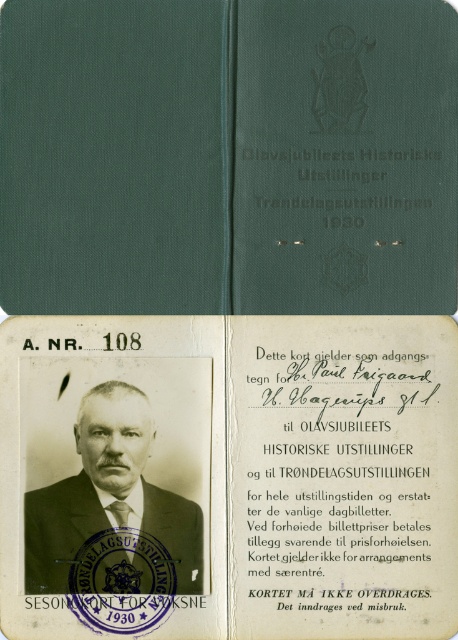
Question: Which is nearer to the white paper card at center?

Choices:
 (A) matte black suit at center
 (B) green fabric journal at center

Answer: (A)

Question: Which object appears farthest from the camera in this image?

Choices:
 (A) white paper card at center
 (B) green fabric journal at center
 (C) matte black suit at center

Answer: (B)

Question: Does white paper card at center appear on the right side of matte black suit at center?

Choices:
 (A) no
 (B) yes

Answer: (B)

Question: Can you confirm if white paper card at center is positioned to the right of green fabric journal at center?

Choices:
 (A) no
 (B) yes

Answer: (B)

Question: Is white paper card at center below matte black suit at center?

Choices:
 (A) yes
 (B) no

Answer: (B)

Question: Among these objects, which one is nearest to the camera?

Choices:
 (A) matte black suit at center
 (B) white paper card at center
 (C) green fabric journal at center

Answer: (B)